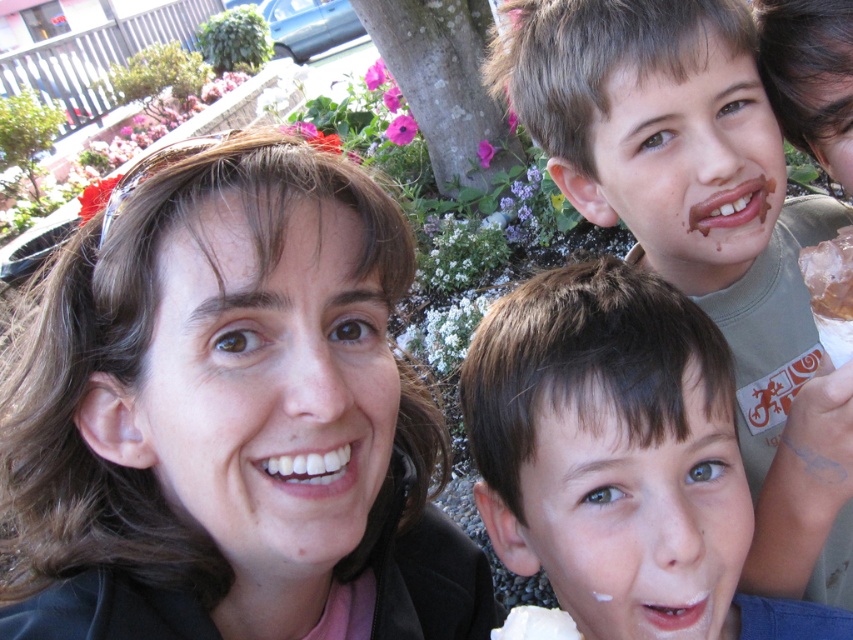
Who is positioned more to the right, black leather jacket at center or white creamy ice cream at lower center?

white creamy ice cream at lower center is more to the right.

Can you confirm if black leather jacket at center is thinner than white creamy ice cream at lower center?

In fact, black leather jacket at center might be wider than white creamy ice cream at lower center.

This screenshot has width=853, height=640. What do you see at coordinates (231, 419) in the screenshot?
I see `black leather jacket at center` at bounding box center [231, 419].

This screenshot has height=640, width=853. I want to click on black leather jacket at center, so click(x=231, y=419).

Between point (631, 563) and point (534, 612), which one is positioned in front?

Point (631, 563)

Who is taller, brown hair boy at center or white creamy ice cream at lower center?

brown hair boy at center is taller.

Which is in front, point (573, 552) or point (535, 624)?

Point (535, 624)

Find the location of a particular element. brown hair boy at center is located at coordinates coord(619,458).

Is black leather jacket at center thinner than brown hair boy at center?

No, black leather jacket at center is not thinner than brown hair boy at center.

Consider the image. Who is taller, black leather jacket at center or brown hair boy at center?

black leather jacket at center is taller.

The image size is (853, 640). I want to click on black leather jacket at center, so click(231, 419).

This screenshot has height=640, width=853. In order to click on black leather jacket at center in this screenshot , I will do `click(231, 419)`.